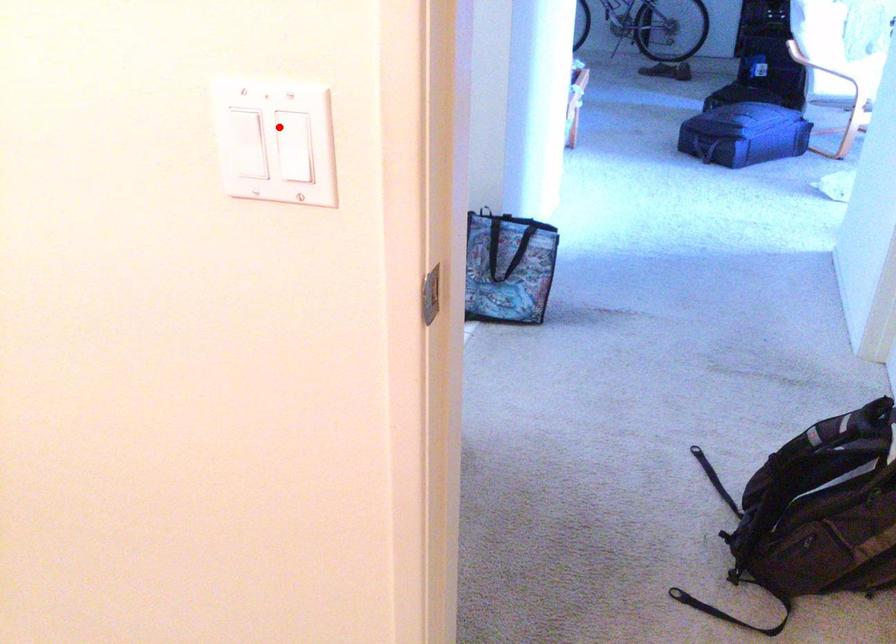
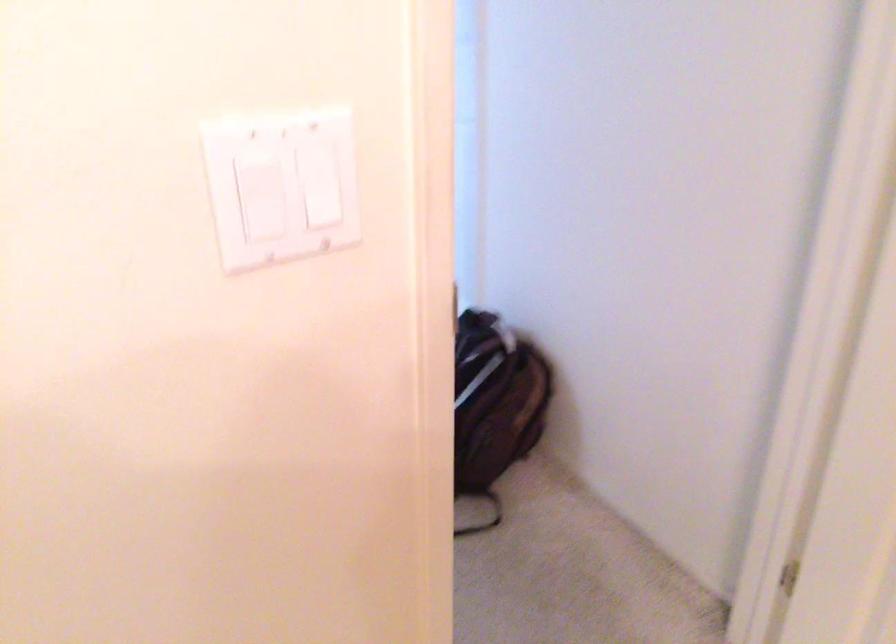
Find the pixel in the second image that matches the highlighted location in the first image.

(326, 192)